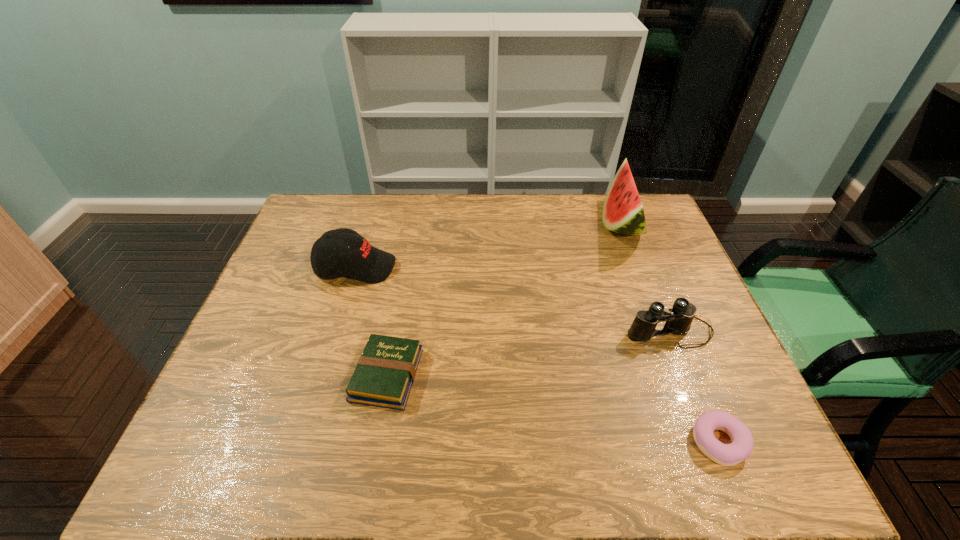
The image size is (960, 540). Identify the location of vacant space at the far edge of the desktop. (460, 225).

You are a GUI agent. You are given a task and a screenshot of the screen. Output one action in this format:
    pyautogui.click(x=<x>, y=<y>)
    Task: Click on the vacant space at the near edge of the desktop
    This screenshot has width=960, height=540.
    Given the screenshot: What is the action you would take?
    pyautogui.click(x=643, y=462)

Image resolution: width=960 pixels, height=540 pixels. In order to click on free spot at the left edge of the desktop in this screenshot , I will do `click(311, 316)`.

This screenshot has height=540, width=960. I want to click on blank space at the right edge of the desktop, so click(x=672, y=281).

You are a GUI agent. You are given a task and a screenshot of the screen. Output one action in this format:
    pyautogui.click(x=<x>, y=<y>)
    Task: Click on the vacant region between the baseball cap and the tallest object
    The height and width of the screenshot is (540, 960).
    Given the screenshot: What is the action you would take?
    pyautogui.click(x=489, y=246)

The image size is (960, 540). What are the coordinates of `vacant point located between the baseball cap and the nearest object` in the screenshot? It's located at (538, 355).

The width and height of the screenshot is (960, 540). I want to click on vacant space that is in between the pastry and the book, so click(553, 409).

This screenshot has height=540, width=960. I want to click on free area in between the book and the tallest object, so click(x=504, y=300).

What are the coordinates of `free area in between the binoculars and the nearest object` in the screenshot? It's located at (694, 387).

At what (x,y) coordinates should I click in order to perform the action: click on free space that is in between the baseball cap and the pastry. Please return your answer as a coordinate pair (x, y). Looking at the image, I should click on (538, 355).